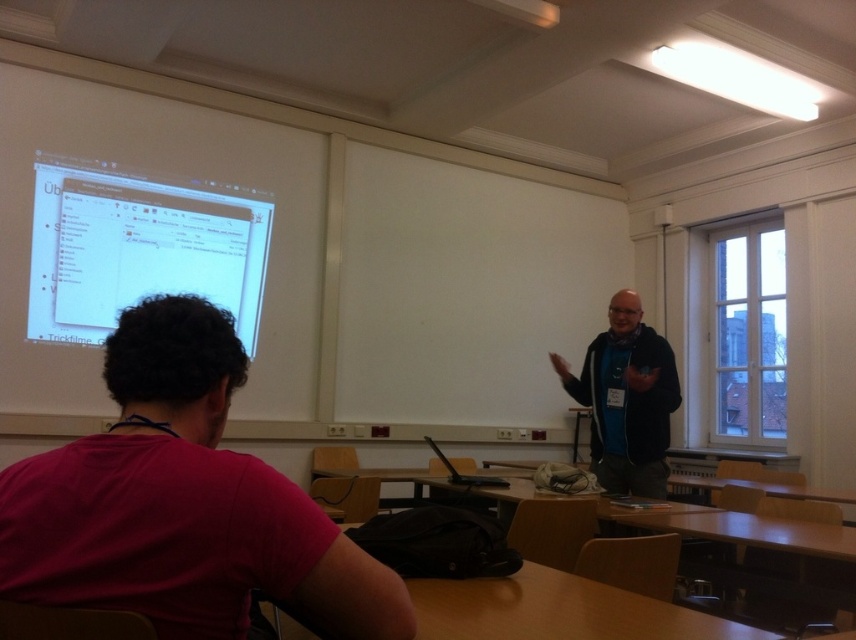
Who is lower down, dark red t-shirt at lower left or matte white projector screen at upper left?

dark red t-shirt at lower left is below.

Consider the image. Is dark red t-shirt at lower left bigger than matte white projector screen at upper left?

Actually, dark red t-shirt at lower left might be smaller than matte white projector screen at upper left.

Is point (159, 586) less distant than point (79, 216)?

Yes, point (159, 586) is in front of point (79, 216).

This screenshot has height=640, width=856. In order to click on dark red t-shirt at lower left in this screenshot , I will do `click(182, 502)`.

Can you confirm if matte white projector screen at upper left is bigger than dark blue sweater at center?

Indeed, matte white projector screen at upper left has a larger size compared to dark blue sweater at center.

Can you confirm if matte white projector screen at upper left is taller than dark blue sweater at center?

Yes.

The height and width of the screenshot is (640, 856). Describe the element at coordinates (140, 248) in the screenshot. I see `matte white projector screen at upper left` at that location.

The height and width of the screenshot is (640, 856). Identify the location of matte white projector screen at upper left. (140, 248).

Between dark red t-shirt at lower left and dark blue sweater at center, which one has more height?

dark blue sweater at center is taller.

Who is more forward, (391, 637) or (648, 445)?

Point (391, 637) is in front.

Does point (186, 332) lie behind point (599, 342)?

No.

Find the location of a particular element. dark red t-shirt at lower left is located at coordinates (182, 502).